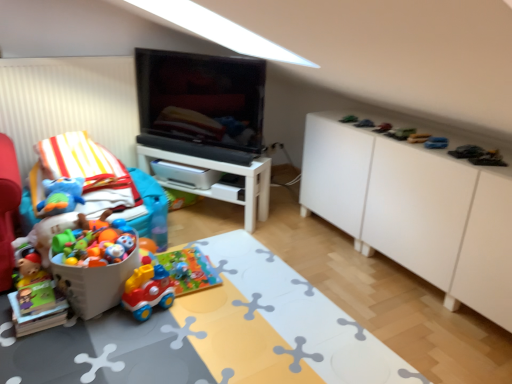
Locate an element on the screen. The image size is (512, 384). free spot in front of rubberized plastic train at center, which appears as the 3th toy when viewed from the left is located at coordinates (139, 330).